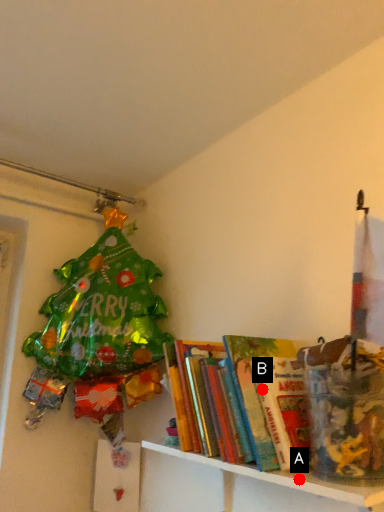
Question: Two points are circled on the image, labeled by A and B beside each circle. Which of the following is the farthest from the observer?

Choices:
 (A) A is further
 (B) B is further

Answer: (B)